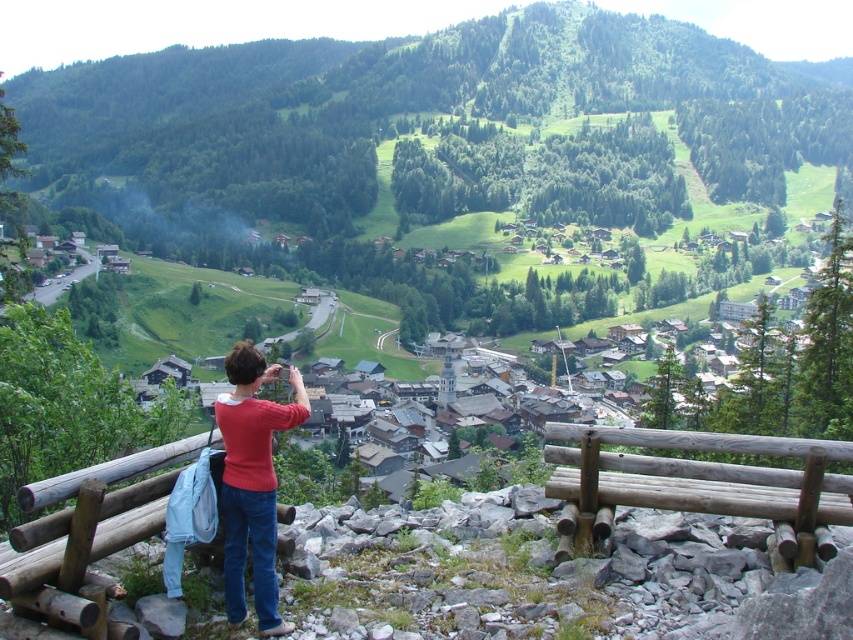
Between brown wooden bench at lower center and matte red sweater at center, which one is positioned higher?

matte red sweater at center

Who is shorter, brown wooden bench at lower center or matte red sweater at center?

Standing shorter between the two is brown wooden bench at lower center.

Does point (778, 488) come farther from viewer compared to point (260, 566)?

Yes, point (778, 488) is farther from viewer.

Identify the location of brown wooden bench at lower center. (700, 476).